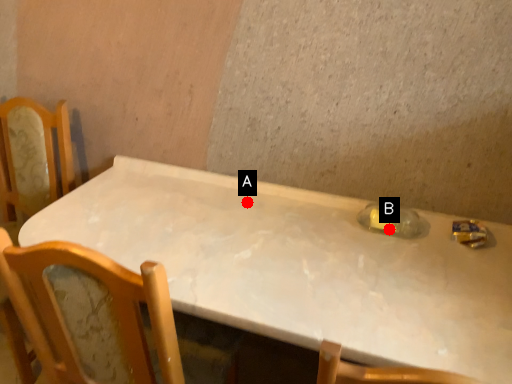
Question: Two points are circled on the image, labeled by A and B beside each circle. Which point is closer to the camera?

Choices:
 (A) A is closer
 (B) B is closer

Answer: (B)